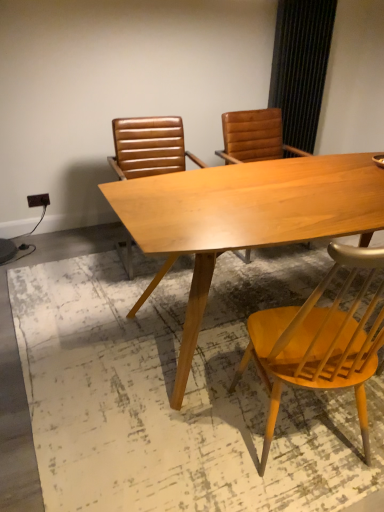
Question: Is light wood table at center not close to leather-like brown chair at center, which ranks as the first chair in back-to-front order?

Choices:
 (A) yes
 (B) no

Answer: (B)

Question: Is light wood table at center facing towards leather-like brown chair at center, the 1th chair from the left?

Choices:
 (A) no
 (B) yes

Answer: (A)

Question: Is light wood table at center wider than leather-like brown chair at center, which is the second chair from right to left?

Choices:
 (A) no
 (B) yes

Answer: (B)

Question: Considering the relative sizes of light wood table at center and leather-like brown chair at center, which ranks as the 2th chair in front-to-back order, in the image provided, is light wood table at center smaller than leather-like brown chair at center, which ranks as the 2th chair in front-to-back order,?

Choices:
 (A) yes
 (B) no

Answer: (B)

Question: Considering the relative sizes of light wood table at center and leather-like brown chair at center, which is the second chair from right to left, in the image provided, is light wood table at center thinner than leather-like brown chair at center, which is the second chair from right to left,?

Choices:
 (A) yes
 (B) no

Answer: (B)

Question: Considering the relative positions of light wood table at center and leather-like brown chair at center, the 1th chair from the left, in the image provided, is light wood table at center to the right of leather-like brown chair at center, the 1th chair from the left, from the viewer's perspective?

Choices:
 (A) yes
 (B) no

Answer: (A)

Question: Is light wood table at center completely or partially outside of light wood chair at lower right, marked as the second chair in a back-to-front arrangement?

Choices:
 (A) no
 (B) yes

Answer: (B)

Question: Are light wood table at center and light wood chair at lower right, marked as the second chair in a back-to-front arrangement, far apart?

Choices:
 (A) yes
 (B) no

Answer: (B)

Question: Is light wood chair at lower right, which appears as the second chair when viewed from the left, at the back of light wood table at center?

Choices:
 (A) yes
 (B) no

Answer: (B)

Question: From the image's perspective, is light wood table at center above light wood chair at lower right, which is the 1th chair in right-to-left order?

Choices:
 (A) yes
 (B) no

Answer: (A)

Question: Is light wood table at center directly adjacent to light wood chair at lower right, which is the 1th chair in right-to-left order?

Choices:
 (A) no
 (B) yes

Answer: (A)

Question: Can you confirm if light wood table at center is taller than light wood chair at lower right, marked as the second chair in a back-to-front arrangement?

Choices:
 (A) yes
 (B) no

Answer: (B)

Question: Does light wood chair at lower right, which appears as the second chair when viewed from the left, have a greater width compared to light wood table at center?

Choices:
 (A) yes
 (B) no

Answer: (B)